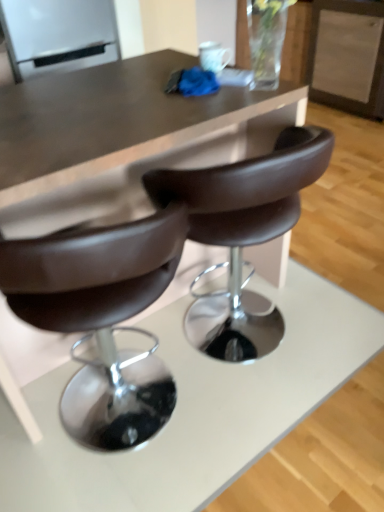
This screenshot has height=512, width=384. Find the location of `empty space that is to the right of brown leather chair at center`. empty space that is to the right of brown leather chair at center is located at coordinates 339,315.